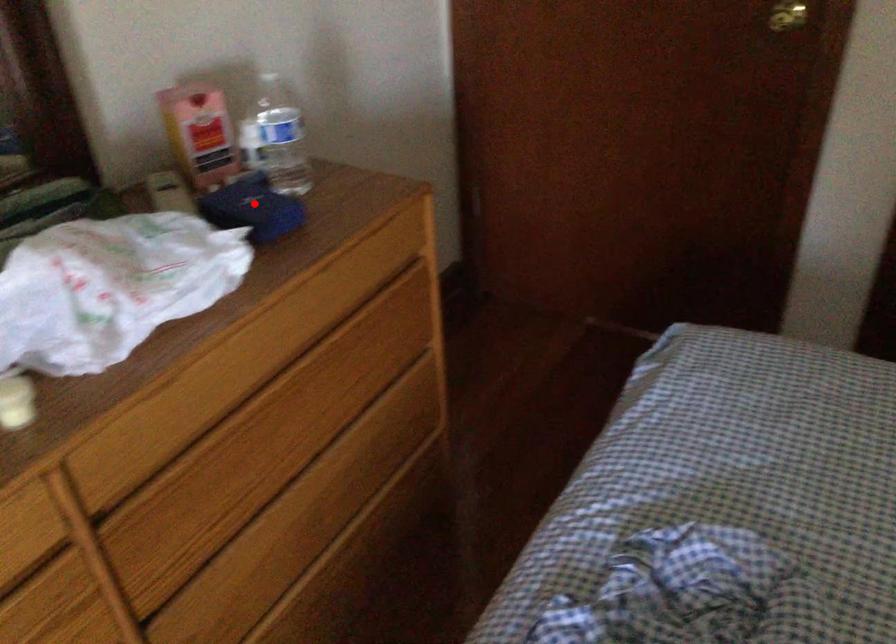
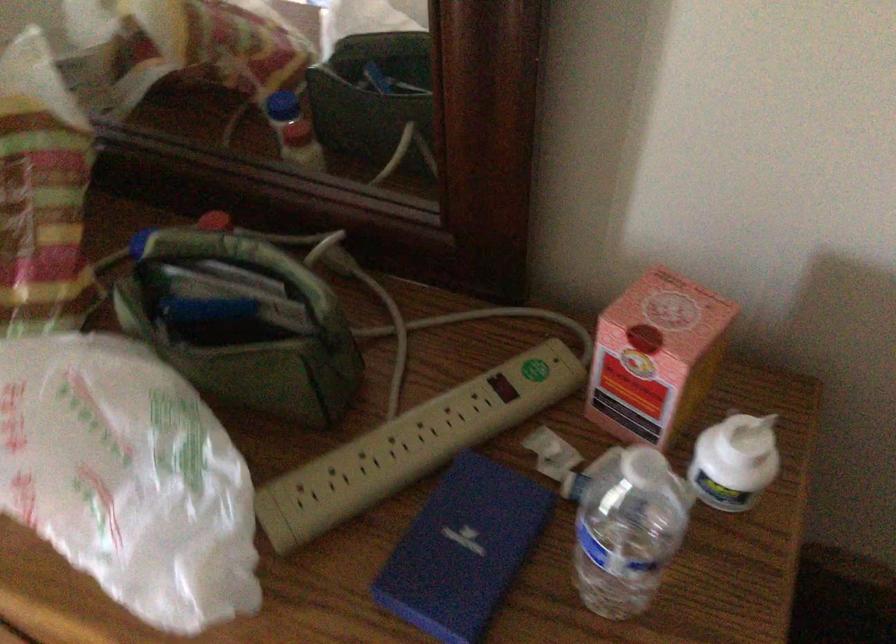
Find the pixel in the second image that matches the highlighted location in the first image.

(462, 550)